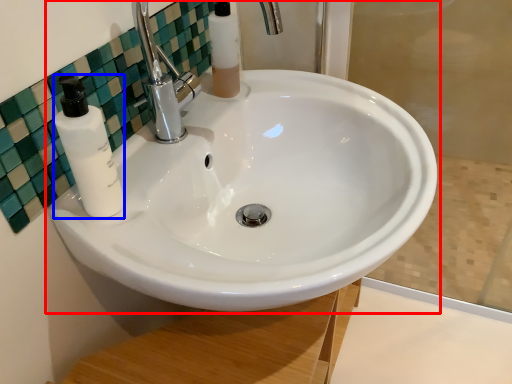
Question: Which object appears closest to the camera in this image, sink (highlighted by a red box) or soap dispenser (highlighted by a blue box)?

Choices:
 (A) sink
 (B) soap dispenser

Answer: (A)